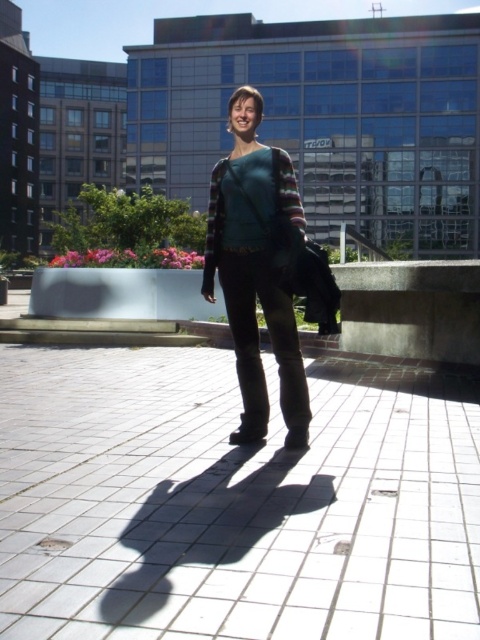
Question: Does matte teal sweater at center appear on the right side of teal knitted sweater at center?

Choices:
 (A) no
 (B) yes

Answer: (B)

Question: Which point is farther to the camera?

Choices:
 (A) (262, 364)
 (B) (211, 195)

Answer: (A)

Question: Can you confirm if matte teal sweater at center is positioned to the right of teal knitted sweater at center?

Choices:
 (A) yes
 (B) no

Answer: (A)

Question: Among these objects, which one is nearest to the camera?

Choices:
 (A) matte teal sweater at center
 (B) white tile pavement at center

Answer: (B)

Question: Which point is farther from the camera taking this photo?

Choices:
 (A) (112, 508)
 (B) (222, 282)
 (C) (218, 202)

Answer: (B)

Question: Is white tile pavement at center below matte teal sweater at center?

Choices:
 (A) no
 (B) yes

Answer: (B)